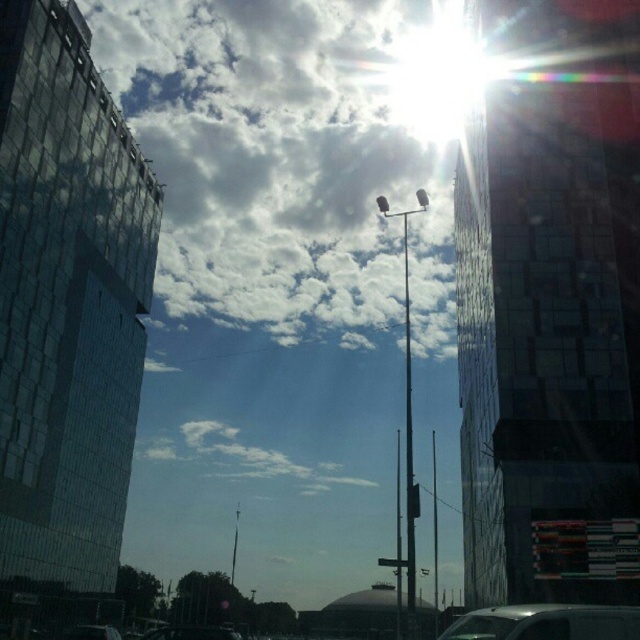
Question: Does white fluffy cloud at upper center have a larger size compared to metallic traffic light at center?

Choices:
 (A) yes
 (B) no

Answer: (A)

Question: Estimate the real-world distances between objects in this image. Which object is closer to the white fluffy cloud at upper center?

Choices:
 (A) metallic traffic light at center
 (B) metallic silver van at center
 (C) white matte car at lower center

Answer: (C)

Question: Which of the following is the farthest from the observer?

Choices:
 (A) (346, 323)
 (B) (419, 492)
 (C) (156, 634)

Answer: (A)

Question: Is white matte car at lower center wider than metallic traffic light at center?

Choices:
 (A) yes
 (B) no

Answer: (A)

Question: Which of these objects is positioned farthest from the metallic traffic light at center?

Choices:
 (A) metallic silver van at center
 (B) white fluffy cloud at upper center
 (C) white matte car at lower center

Answer: (B)

Question: Can you confirm if white fluffy cloud at upper center is positioned to the right of white matte car at lower center?

Choices:
 (A) no
 (B) yes

Answer: (A)